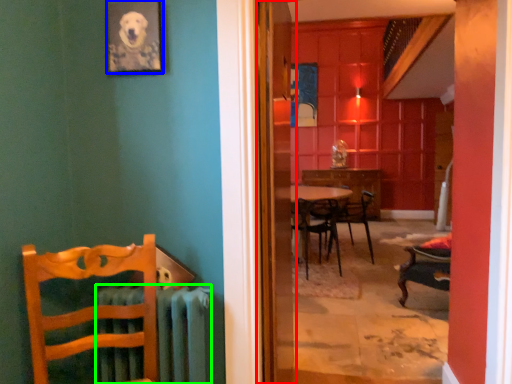
Question: Considering the real-world distances, which object is farthest from screen door (highlighted by a red box)? picture frame (highlighted by a blue box) or radiator (highlighted by a green box)?

Choices:
 (A) picture frame
 (B) radiator

Answer: (A)